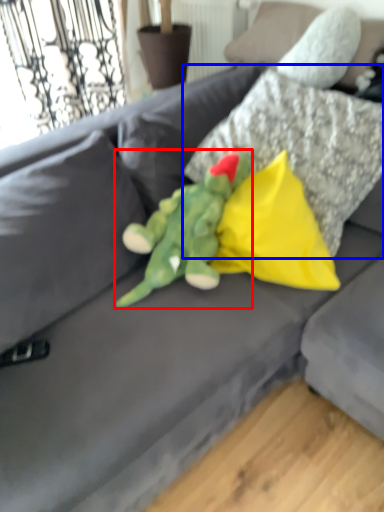
Question: Which object appears farthest to the camera in this image, toy (highlighted by a red box) or pillow (highlighted by a blue box)?

Choices:
 (A) toy
 (B) pillow

Answer: (B)